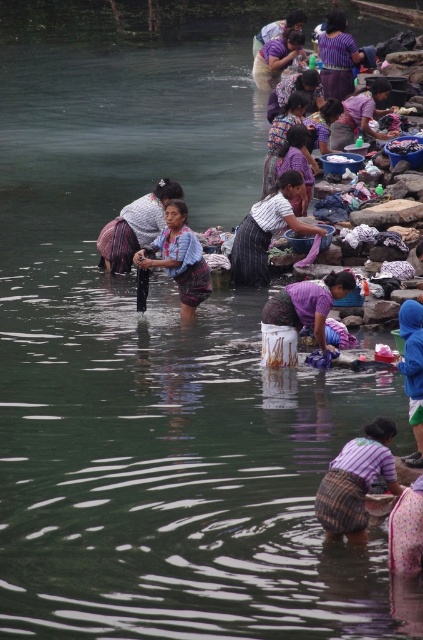
Based on the coordinates provided, where is the purple woven skirt at lower center located in the image?

The purple woven skirt at lower center is located at the coordinates point (310, 307).

You are standing at the edge of the river and see two points marked in the scene. Which point is closer to you, point [290,120] or point [304,172]?

Point [290,120] is closer to you because it is further to the viewer than point [304,172].